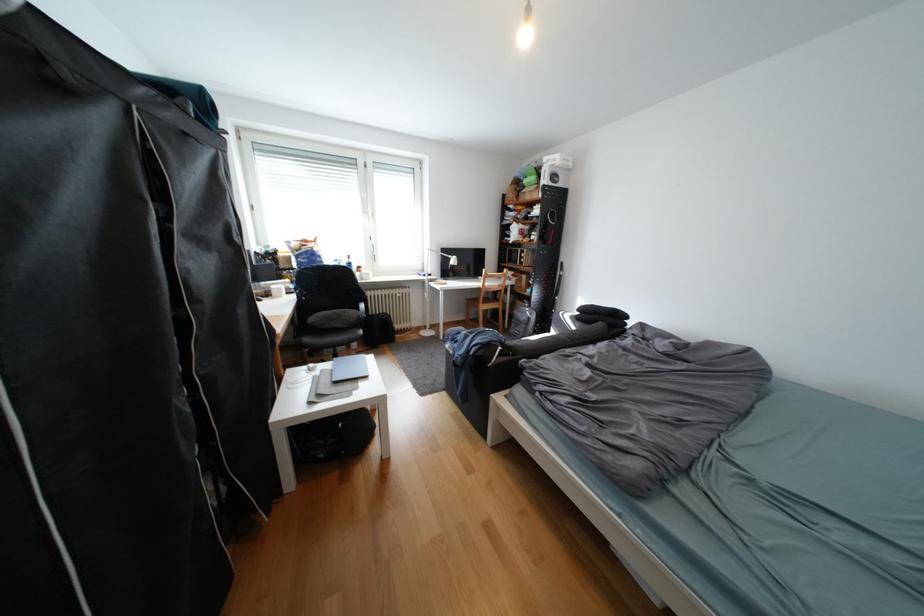
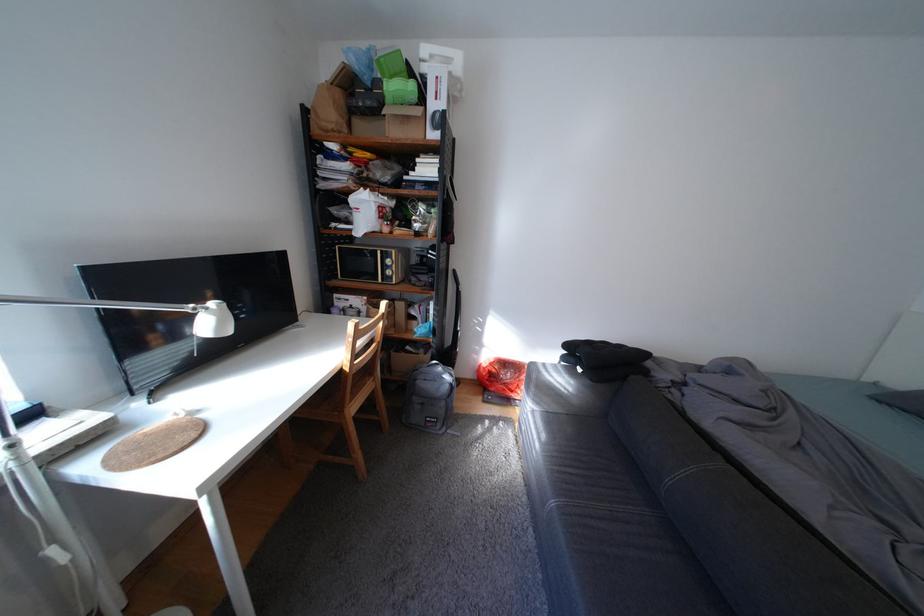
Where in the second image is the point corresponding to (537,188) from the first image?

(395, 103)